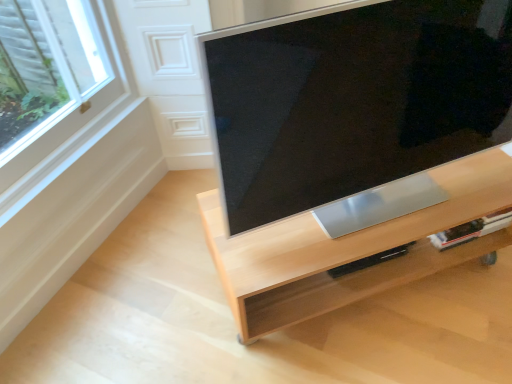
This screenshot has height=384, width=512. What do you see at coordinates (352, 99) in the screenshot? I see `satin silver tv at center` at bounding box center [352, 99].

The width and height of the screenshot is (512, 384). In order to click on satin silver tv at center in this screenshot , I will do pos(352,99).

Image resolution: width=512 pixels, height=384 pixels. I want to click on light wood tv stand at center, so click(349, 249).

The image size is (512, 384). What do you see at coordinates (349, 249) in the screenshot?
I see `light wood tv stand at center` at bounding box center [349, 249].

In order to face light wood tv stand at center, should I rotate leftwards or rightwards?

Turn right approximately 14.335 degrees to face it.

Where is `satin silver tv at center`? satin silver tv at center is located at coordinates (352, 99).

Considering the relative positions of light wood tv stand at center and satin silver tv at center in the image provided, is light wood tv stand at center to the left or to the right of satin silver tv at center?

light wood tv stand at center is to the left of satin silver tv at center.

Between light wood tv stand at center and satin silver tv at center, which one is positioned behind?

light wood tv stand at center is further away from the camera.

Is point (462, 259) less distant than point (232, 121)?

No, it is not.

From the image's perspective, is light wood tv stand at center over satin silver tv at center?

Incorrect, from the image's perspective, light wood tv stand at center is lower than satin silver tv at center.

From a real-world perspective, who is located higher, light wood tv stand at center or satin silver tv at center?

satin silver tv at center.

Between light wood tv stand at center and satin silver tv at center, which one has larger width?

With larger width is light wood tv stand at center.

Between light wood tv stand at center and satin silver tv at center, which one has more height?

satin silver tv at center is taller.

Does light wood tv stand at center have a larger size compared to satin silver tv at center?

Correct, light wood tv stand at center is larger in size than satin silver tv at center.

Could satin silver tv at center be considered to be inside light wood tv stand at center?

No, light wood tv stand at center does not contain satin silver tv at center.

Is light wood tv stand at center next to satin silver tv at center and touching it?

No, light wood tv stand at center is not next to satin silver tv at center.

Is light wood tv stand at center oriented towards satin silver tv at center?

No.

Can you tell me how much light wood tv stand at center and satin silver tv at center differ in facing direction?

The facing directions of light wood tv stand at center and satin silver tv at center are 0.14 degrees apart.

How far apart are light wood tv stand at center and satin silver tv at center?

A distance of 30.12 centimeters exists between light wood tv stand at center and satin silver tv at center.

Identify the location of furniture behind the satin silver tv at center. The image size is (512, 384). (349, 249).

Consider the image. Considering the positions of objects satin silver tv at center and light wood tv stand at center in the image provided, who is more to the right, satin silver tv at center or light wood tv stand at center?

satin silver tv at center.

Is satin silver tv at center in front of light wood tv stand at center?

Yes, the depth of satin silver tv at center is less than that of light wood tv stand at center.

Is point (348, 85) more distant than point (332, 287)?

No, it is in front of (332, 287).

From the image's perspective, is satin silver tv at center located above light wood tv stand at center?

Yes, from the image's perspective, satin silver tv at center is on top of light wood tv stand at center.

From a real-world perspective, who is located higher, satin silver tv at center or light wood tv stand at center?

satin silver tv at center, from a real-world perspective.

Can you confirm if satin silver tv at center is thinner than light wood tv stand at center?

Correct, the width of satin silver tv at center is less than that of light wood tv stand at center.

Between satin silver tv at center and light wood tv stand at center, which one has less height?

light wood tv stand at center.

Can you confirm if satin silver tv at center is smaller than light wood tv stand at center?

Correct, satin silver tv at center occupies less space than light wood tv stand at center.

Is light wood tv stand at center inside satin silver tv at center?

No.

Is satin silver tv at center directly adjacent to light wood tv stand at center?

No, satin silver tv at center is not touching light wood tv stand at center.

Is light wood tv stand at center at the back of satin silver tv at center?

No, satin silver tv at center is not facing away from light wood tv stand at center.

How distant is satin silver tv at center from light wood tv stand at center?

satin silver tv at center is 11.86 inches away from light wood tv stand at center.

The image size is (512, 384). Identify the location of television that appears above the light wood tv stand at center (from a real-world perspective). (352, 99).

Where is `furniture behind the satin silver tv at center`? The width and height of the screenshot is (512, 384). furniture behind the satin silver tv at center is located at coordinates (349, 249).

At what (x,y) coordinates should I click in order to perform the action: click on furniture beneath the satin silver tv at center (from a real-world perspective). Please return your answer as a coordinate pair (x, y). Image resolution: width=512 pixels, height=384 pixels. Looking at the image, I should click on [349, 249].